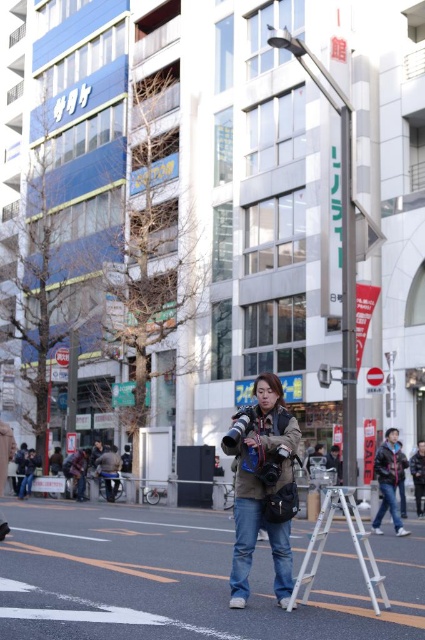
Question: Observing the image, what is the correct spatial positioning of denim jacket at center in reference to dark blue jacket at center?

Choices:
 (A) right
 (B) left

Answer: (B)

Question: Is denim jacket at center wider than dark blue jacket at center?

Choices:
 (A) no
 (B) yes

Answer: (A)

Question: Which of the following is the farthest from the observer?

Choices:
 (A) (360, 564)
 (B) (274, 472)

Answer: (A)

Question: Among these points, which one is nearest to the camera?

Choices:
 (A) (359, 541)
 (B) (396, 456)

Answer: (A)

Question: From the image, what is the correct spatial relationship of silver metallic ladder at center in relation to dark blue jacket at center?

Choices:
 (A) left
 (B) right

Answer: (A)

Question: Which is nearer to the denim jacket at center?

Choices:
 (A) silver metallic ladder at center
 (B) dark blue jacket at center

Answer: (A)